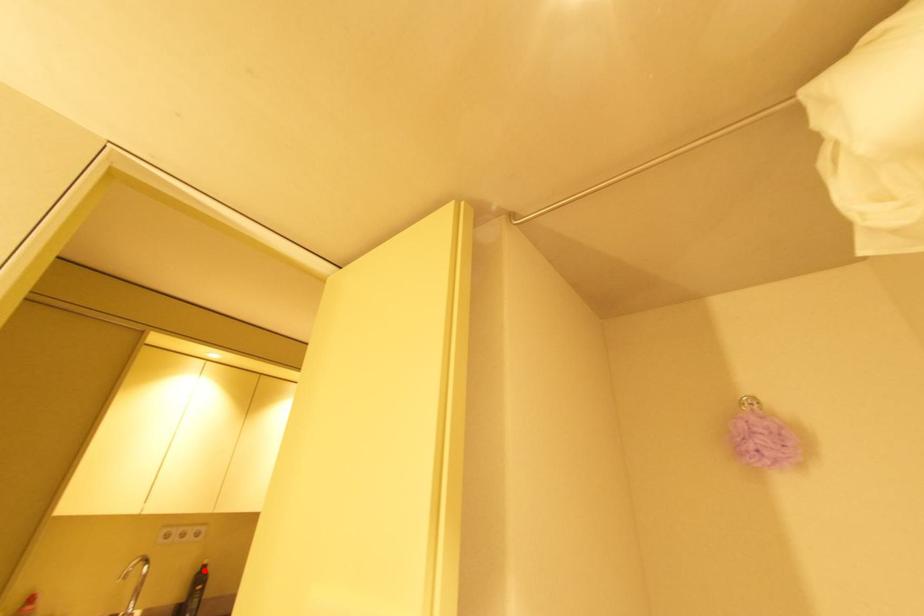
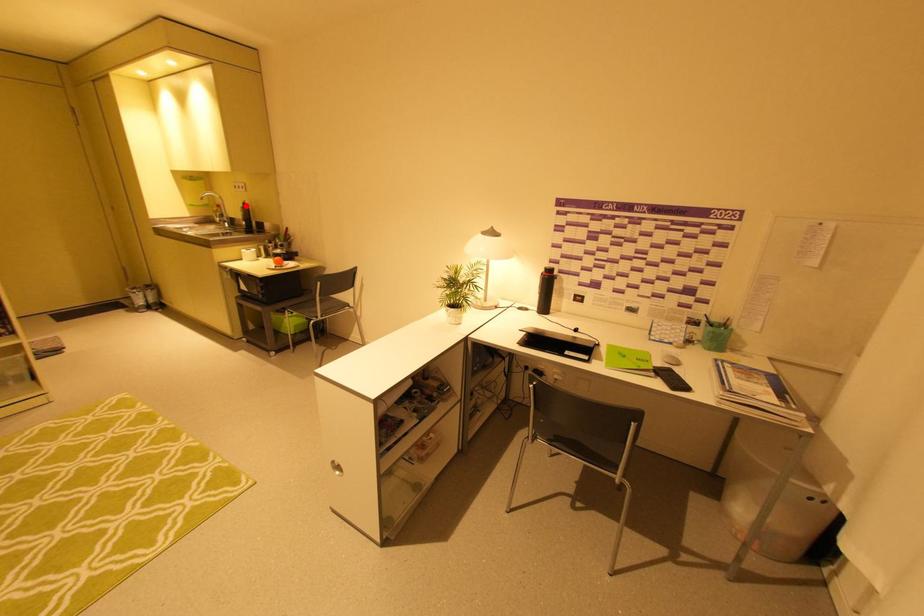
I am providing you with two images of the same scene from different viewpoints. A red point is marked on the first image and another point is marked on the second image. Does the point marked in image1 correspond to the same location as the one in image2?

Yes